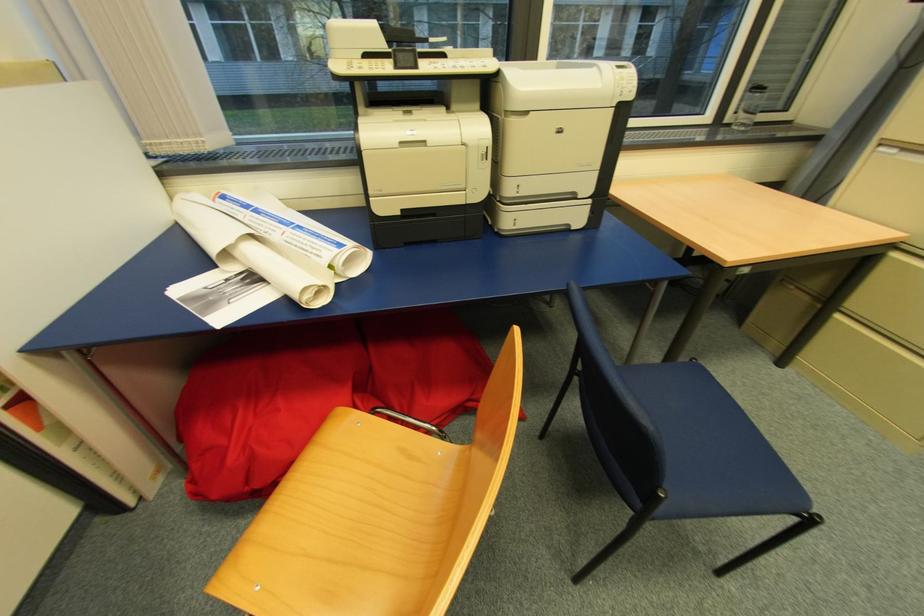
Find where to sit the blue chair sitting surface. Please return your answer as a coordinate pair (x, y).

(700, 432)